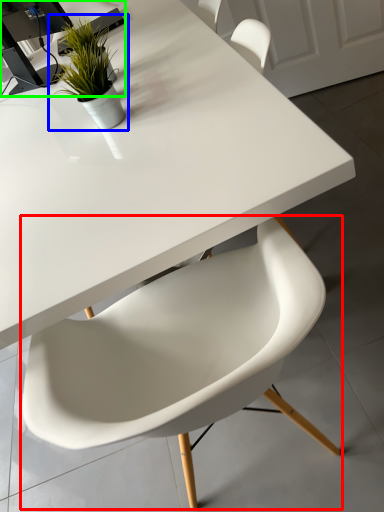
Question: Estimate the real-world distances between objects in this image. Which object is farther from chair (highlighted by a red box), houseplant (highlighted by a blue box) or computer desk (highlighted by a green box)?

Choices:
 (A) houseplant
 (B) computer desk

Answer: (B)